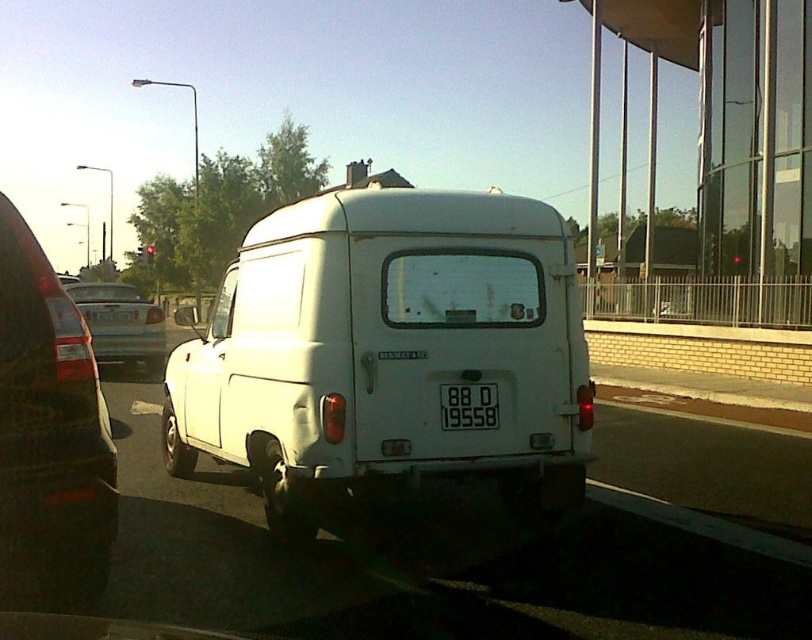
Which is above, white matte van at center or silver metallic sedan at center-left?

Positioned higher is silver metallic sedan at center-left.

Can you confirm if white matte van at center is bigger than silver metallic sedan at center-left?

Actually, white matte van at center might be smaller than silver metallic sedan at center-left.

Describe the element at coordinates (389, 353) in the screenshot. I see `white matte van at center` at that location.

Image resolution: width=812 pixels, height=640 pixels. In order to click on white matte van at center in this screenshot , I will do `click(389, 353)`.

Who is shorter, white matte van at center or black plastic license plate at center?

black plastic license plate at center is shorter.

Can you confirm if white matte van at center is positioned to the left of black plastic license plate at center?

Yes, white matte van at center is to the left of black plastic license plate at center.

This screenshot has width=812, height=640. What do you see at coordinates (389, 353) in the screenshot? I see `white matte van at center` at bounding box center [389, 353].

Locate an element on the screen. white matte van at center is located at coordinates [389, 353].

Is the position of matte black van at left more distant than that of black plastic license plate at center?

No, it is not.

The image size is (812, 640). What are the coordinates of `matte black van at left` in the screenshot? It's located at (50, 424).

You are a GUI agent. You are given a task and a screenshot of the screen. Output one action in this format:
    pyautogui.click(x=<x>, y=<y>)
    Task: Click on the matte black van at left
    The width and height of the screenshot is (812, 640).
    Given the screenshot: What is the action you would take?
    pyautogui.click(x=50, y=424)

Locate an element on the screen. matte black van at left is located at coordinates (50, 424).